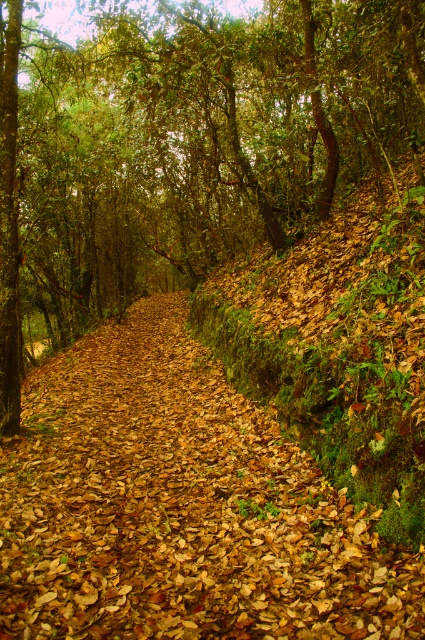
Does green leafy tree at center come in front of brown leafy forest path at center?

No, it is not.

Between point (17, 124) and point (189, 632), which one is positioned behind?

Positioned behind is point (17, 124).

Identify the location of green leafy tree at center. The image size is (425, 640). (184, 147).